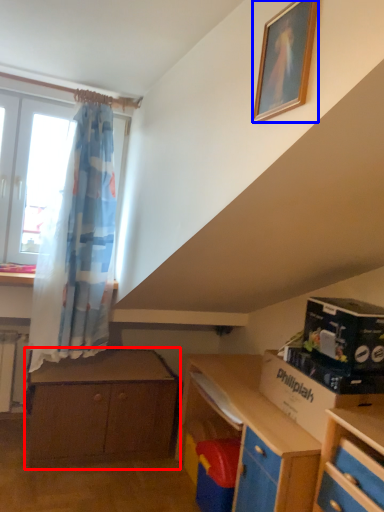
Question: Which of the following is the closest to the observer, chest of drawers (highlighted by a red box) or picture frame (highlighted by a blue box)?

Choices:
 (A) chest of drawers
 (B) picture frame

Answer: (B)